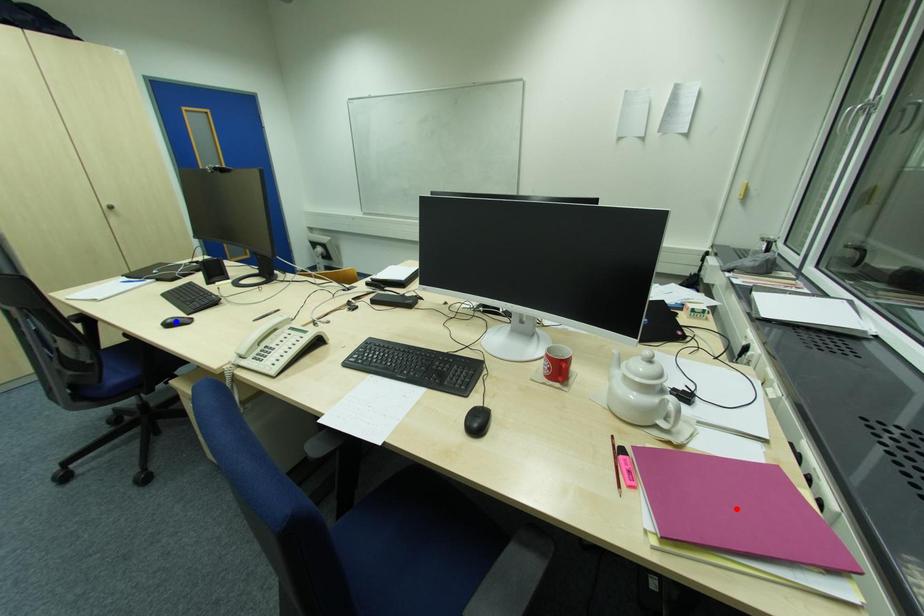
Question: Two points are marked on the image. Which point is closer to the camera?

Choices:
 (A) Blue point is closer.
 (B) Red point is closer.

Answer: (B)